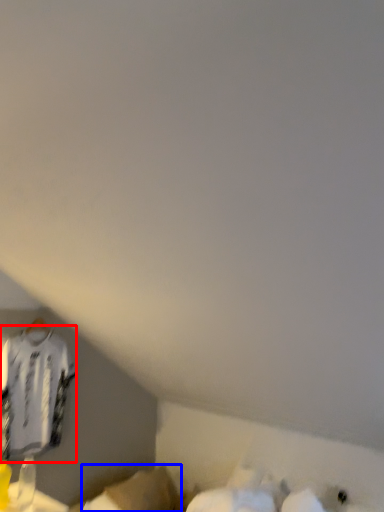
Question: Which of the following is the farthest to the observer, clothing (highlighted by a red box) or wide (highlighted by a blue box)?

Choices:
 (A) clothing
 (B) wide

Answer: (B)